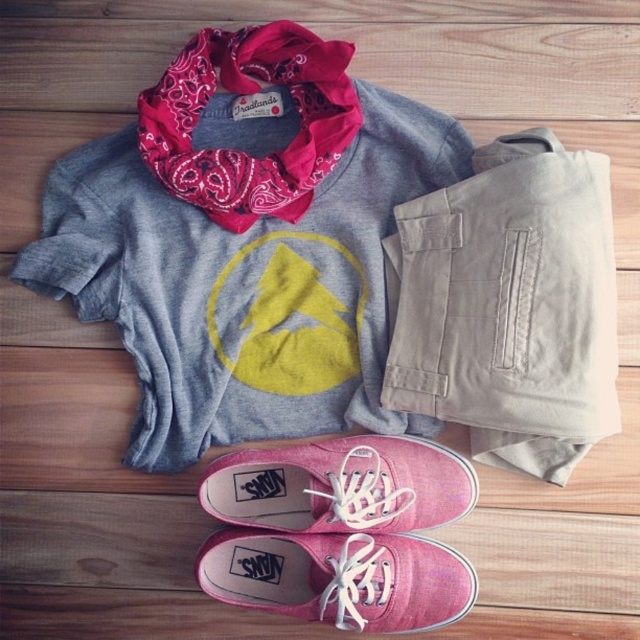
Question: Is khaki cotton pants at center-right further to the viewer compared to pink canvas shoe at lower center?

Choices:
 (A) yes
 (B) no

Answer: (B)

Question: Estimate the real-world distances between objects in this image. Which object is closer to the pink canvas sneakers at lower center?

Choices:
 (A) khaki cotton pants at center-right
 (B) pink canvas shoe at lower center

Answer: (B)

Question: Can you confirm if matte gray sweatshirt with yellow graphic at center is positioned to the left of pink canvas shoe at lower center?

Choices:
 (A) yes
 (B) no

Answer: (A)

Question: Which of the following is the closest to the observer?

Choices:
 (A) (545, 252)
 (B) (301, 516)
 (C) (426, 616)
 (D) (401, 106)

Answer: (A)

Question: Can you confirm if khaki cotton pants at center-right is smaller than pink canvas shoe at lower center?

Choices:
 (A) no
 (B) yes

Answer: (A)

Question: Based on their relative distances, which object is nearer to the pink canvas sneakers at lower center?

Choices:
 (A) pink canvas shoe at lower center
 (B) matte gray sweatshirt with yellow graphic at center
 (C) khaki cotton pants at center-right

Answer: (A)